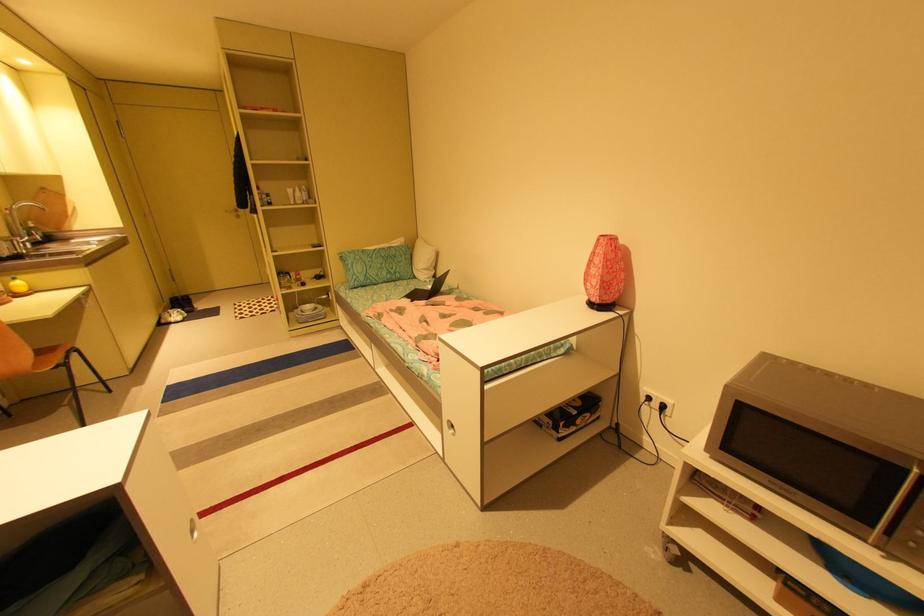
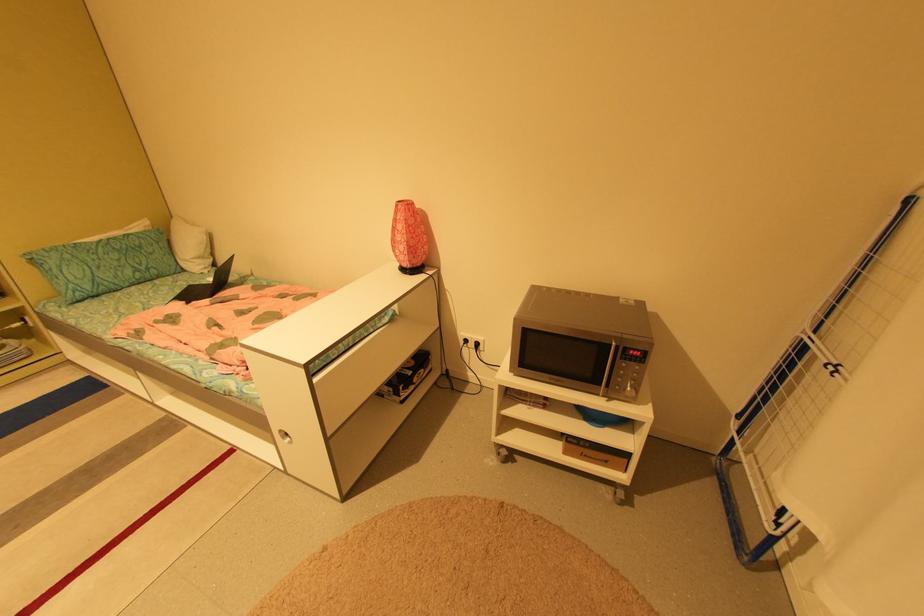
The point at (431, 290) is marked in the first image. Where is the corresponding point in the second image?

(210, 284)